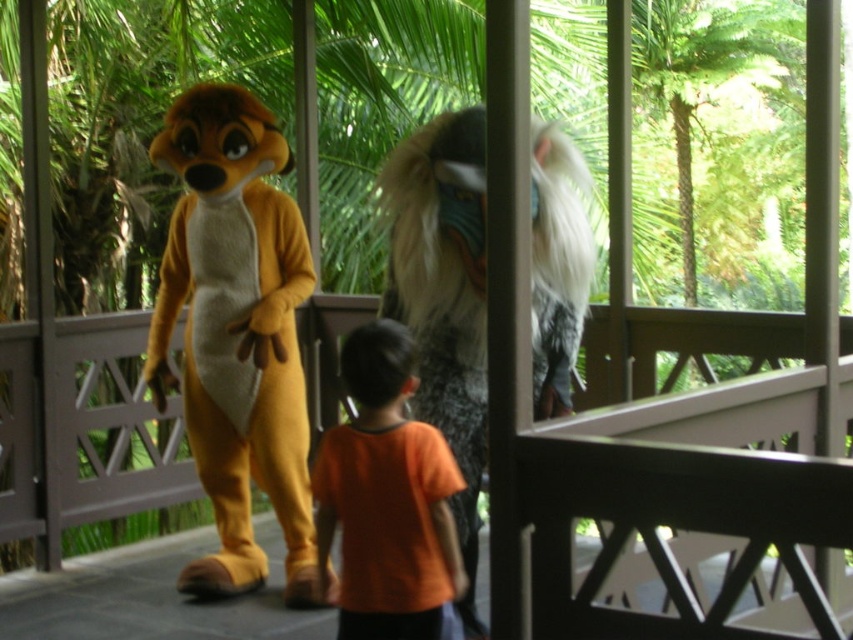
Between fuzzy gray fur at center and orange cotton shirt at center, which one appears on the left side from the viewer's perspective?

orange cotton shirt at center

Does fuzzy gray fur at center have a lesser height compared to orange cotton shirt at center?

No, fuzzy gray fur at center is not shorter than orange cotton shirt at center.

What do you see at coordinates (445, 298) in the screenshot?
I see `fuzzy gray fur at center` at bounding box center [445, 298].

Where is `fuzzy gray fur at center`? This screenshot has width=853, height=640. fuzzy gray fur at center is located at coordinates (445, 298).

Can you confirm if orange plush mascot at left is shorter than fuzzy gray fur at center?

No, orange plush mascot at left is not shorter than fuzzy gray fur at center.

Between orange plush mascot at left and fuzzy gray fur at center, which one appears on the right side from the viewer's perspective?

From the viewer's perspective, fuzzy gray fur at center appears more on the right side.

Between point (209, 332) and point (409, 300), which one is positioned in front?

Point (409, 300) is more forward.

Find the location of `orange plush mascot at left`. orange plush mascot at left is located at coordinates (236, 332).

Is point (252, 234) positioned after point (316, 525)?

Yes, it is behind point (316, 525).

Is orange plush mascot at left behind orange cotton shirt at center?

Yes, orange plush mascot at left is behind orange cotton shirt at center.

Find the location of a particular element. This screenshot has height=640, width=853. orange plush mascot at left is located at coordinates (236, 332).

At what (x,y) coordinates should I click in order to perform the action: click on orange plush mascot at left. Please return your answer as a coordinate pair (x, y). Looking at the image, I should click on (236, 332).